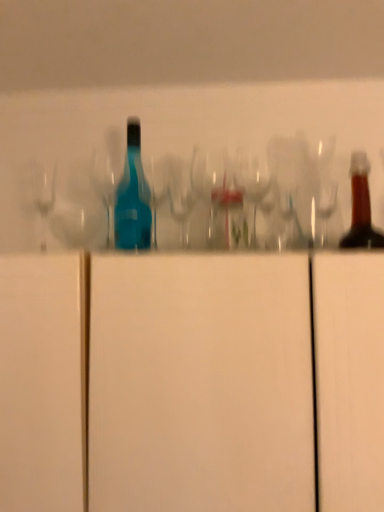
Question: From the image's perspective, is white matte cabinet at center above clear glass wine glass at center?

Choices:
 (A) no
 (B) yes

Answer: (A)

Question: Is white matte cabinet at center thinner than clear glass wine glass at center?

Choices:
 (A) no
 (B) yes

Answer: (A)

Question: Is white matte cabinet at center taller than clear glass wine glass at center?

Choices:
 (A) no
 (B) yes

Answer: (B)

Question: Does white matte cabinet at center have a lesser height compared to clear glass wine glass at center?

Choices:
 (A) yes
 (B) no

Answer: (B)

Question: From the image's perspective, would you say white matte cabinet at center is shown under clear glass wine glass at center?

Choices:
 (A) yes
 (B) no

Answer: (A)

Question: From a real-world perspective, relative to transparent glass shot glass at center, is white matte cabinet at center vertically above or below?

Choices:
 (A) below
 (B) above

Answer: (A)

Question: Considering their positions, is white matte cabinet at center located in front of or behind transparent glass shot glass at center?

Choices:
 (A) front
 (B) behind

Answer: (A)

Question: Would you say white matte cabinet at center is inside or outside transparent glass shot glass at center?

Choices:
 (A) outside
 (B) inside

Answer: (A)

Question: From the image's perspective, is white matte cabinet at center above or below transparent glass shot glass at center?

Choices:
 (A) below
 (B) above

Answer: (A)

Question: In the image, is transparent glass shot glass at center positioned in front of or behind white matte cabinet at center?

Choices:
 (A) front
 (B) behind

Answer: (B)

Question: From a real-world perspective, relative to white matte cabinet at center, is transparent glass shot glass at center vertically above or below?

Choices:
 (A) below
 (B) above

Answer: (B)

Question: Would you say transparent glass shot glass at center is inside or outside white matte cabinet at center?

Choices:
 (A) outside
 (B) inside

Answer: (A)

Question: From the image's perspective, is transparent glass shot glass at center located above or below white matte cabinet at center?

Choices:
 (A) below
 (B) above

Answer: (B)

Question: Considering their positions, is clear glass wine glass at center located in front of or behind white matte cabinet at center?

Choices:
 (A) behind
 (B) front

Answer: (A)

Question: Is clear glass wine glass at center inside or outside of white matte cabinet at center?

Choices:
 (A) outside
 (B) inside

Answer: (A)